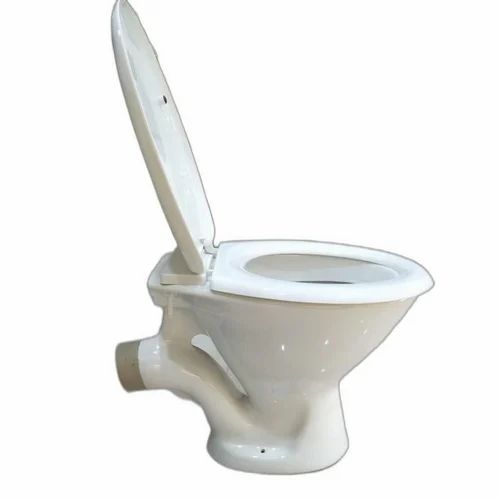
Find the location of a particular element. screw hole is located at coordinates (262, 450).